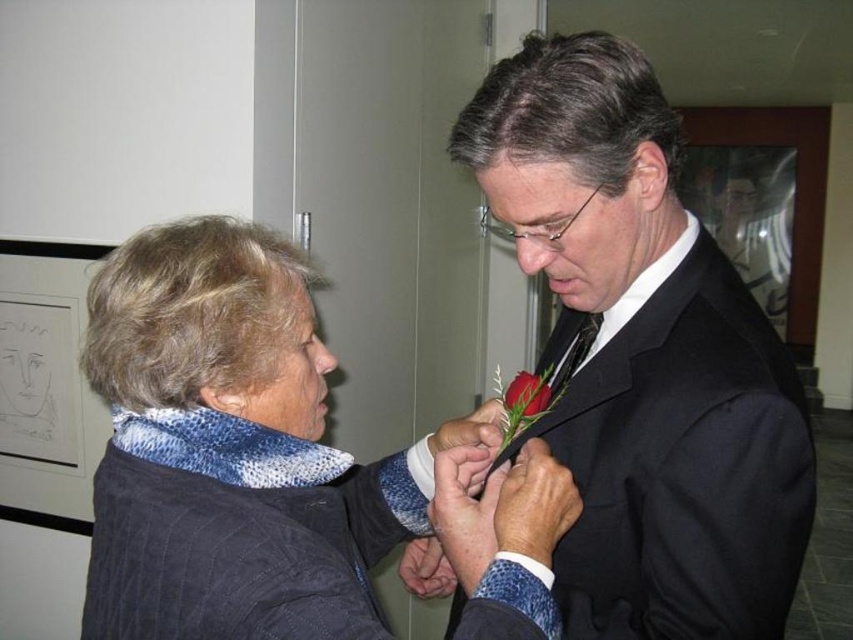
Can you confirm if black satin suit at center is positioned to the right of blue textured scarf at left?

Correct, you'll find black satin suit at center to the right of blue textured scarf at left.

Between black satin suit at center and blue textured scarf at left, which one appears on the right side from the viewer's perspective?

Positioned to the right is black satin suit at center.

I want to click on black satin suit at center, so 643,355.

Between point (701, 356) and point (540, 388), which one is positioned behind?

The point (540, 388) is behind.

This screenshot has width=853, height=640. What are the coordinates of `black satin suit at center` in the screenshot? It's located at (643, 355).

What are the coordinates of `black satin suit at center` in the screenshot? It's located at click(643, 355).

Is blue textured scarf at left closer to the viewer compared to red velvet rose at center?

Yes, it is.

Does blue textured scarf at left have a smaller size compared to red velvet rose at center?

Incorrect, blue textured scarf at left is not smaller in size than red velvet rose at center.

In order to click on blue textured scarf at left in this screenshot , I will do `click(276, 464)`.